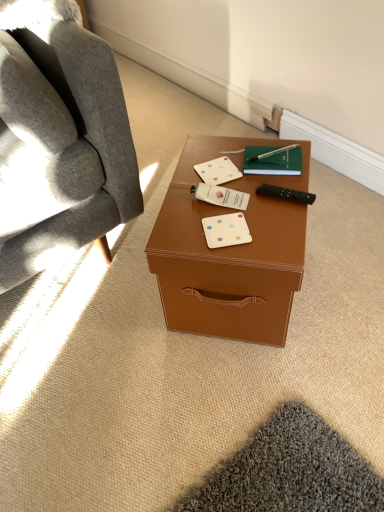
The height and width of the screenshot is (512, 384). What are the coordinates of `vacant point to the left of white matte business card at center, marked as the 2th business card in a back-to-front arrangement` in the screenshot? It's located at (178, 207).